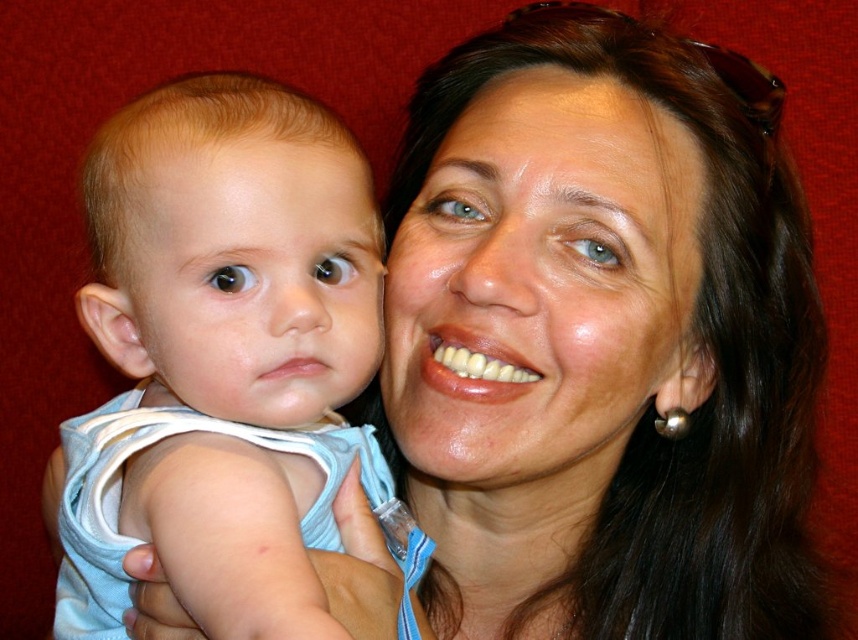
Which is more to the left, light blue fabric baby at left or smooth skin face at center?

Positioned to the left is light blue fabric baby at left.

Does light blue fabric baby at left have a greater width compared to smooth skin face at center?

Yes, light blue fabric baby at left is wider than smooth skin face at center.

This screenshot has height=640, width=858. What do you see at coordinates (221, 355) in the screenshot?
I see `light blue fabric baby at left` at bounding box center [221, 355].

Where is `light blue fabric baby at left`? light blue fabric baby at left is located at coordinates click(x=221, y=355).

Can you confirm if smooth skin face at center is positioned below smooth skin baby at center?

Yes.

Can you confirm if smooth skin face at center is positioned to the left of smooth skin baby at center?

No, smooth skin face at center is not to the left of smooth skin baby at center.

Describe the element at coordinates (544, 285) in the screenshot. I see `smooth skin face at center` at that location.

Identify the location of smooth skin face at center. This screenshot has width=858, height=640. (544, 285).

Does light blue fabric baby at left come behind smooth skin baby at center?

No.

Is light blue fabric baby at left to the left of smooth skin baby at center from the viewer's perspective?

Incorrect, light blue fabric baby at left is not on the left side of smooth skin baby at center.

What do you see at coordinates (221, 355) in the screenshot?
I see `light blue fabric baby at left` at bounding box center [221, 355].

Locate an element on the screen. This screenshot has width=858, height=640. light blue fabric baby at left is located at coordinates (221, 355).